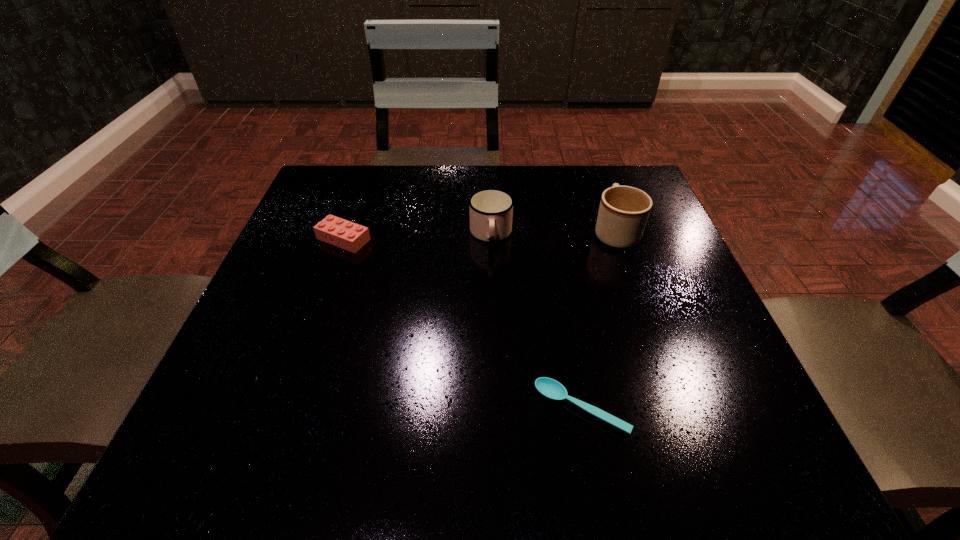
The image size is (960, 540). Identify the location of free space located on the side of the right mug with the handle. (598, 184).

You are a GUI agent. You are given a task and a screenshot of the screen. Output one action in this format:
    pyautogui.click(x=<x>, y=<y>)
    Task: Click on the vacant area located 0.070m on the side of the shorter mug with the handle
    This screenshot has width=960, height=540.
    Given the screenshot: What is the action you would take?
    (492, 276)

Identify the location of vacant point located on the right of the leftmost object. The image size is (960, 540). click(x=527, y=239).

At what (x,y) coordinates should I click in order to perform the action: click on vacant space positioned on the back of the nearest object. Please return your answer as a coordinate pair (x, y). This screenshot has width=960, height=540. Looking at the image, I should click on (557, 274).

Identify the location of object positioned at the near edge. The height and width of the screenshot is (540, 960). (550, 388).

Identify the location of object that is at the left edge. This screenshot has width=960, height=540. (339, 232).

The height and width of the screenshot is (540, 960). I want to click on object that is at the right edge, so click(x=623, y=213).

Where is `object located in the far right corner section of the desktop`? The width and height of the screenshot is (960, 540). object located in the far right corner section of the desktop is located at coordinates (623, 213).

Find the location of a particular element. free space at the far edge of the desktop is located at coordinates (416, 174).

Find the location of a particular element. blank space at the near edge of the desktop is located at coordinates (660, 458).